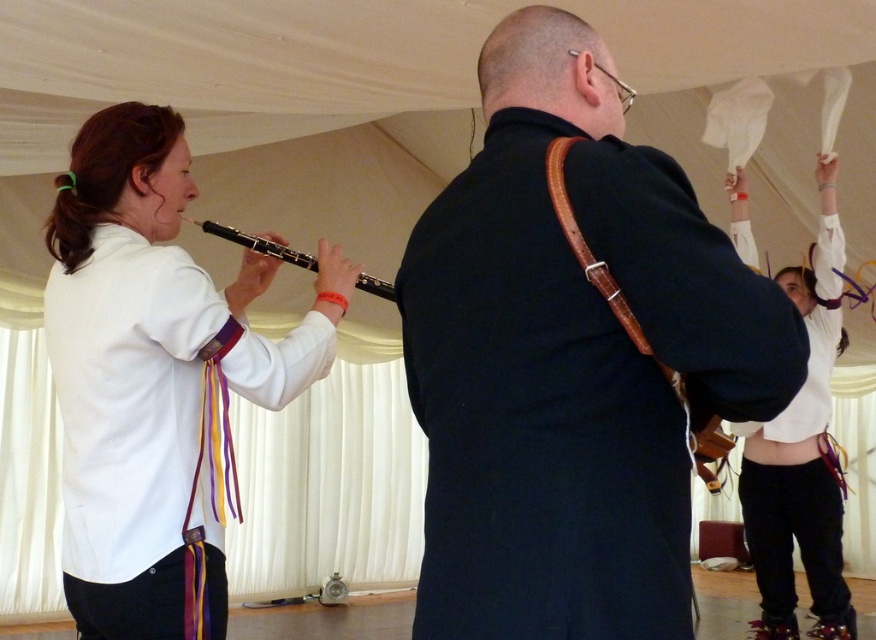
Question: Is dark blue jacket at center bigger than white matte pants at lower right?

Choices:
 (A) no
 (B) yes

Answer: (A)

Question: Among these points, which one is farthest from the camera?

Choices:
 (A) (576, 196)
 (B) (152, 493)
 (C) (361, 276)

Answer: (C)

Question: Based on their relative distances, which object is farther from the white matte flute at left?

Choices:
 (A) black wood flute at left
 (B) white matte pants at lower right

Answer: (B)

Question: Does white matte pants at lower right appear under black wood flute at left?

Choices:
 (A) no
 (B) yes

Answer: (B)

Question: Can you confirm if white matte flute at left is bigger than white matte pants at lower right?

Choices:
 (A) no
 (B) yes

Answer: (A)

Question: Which of the following is the farthest from the observer?

Choices:
 (A) white matte flute at left
 (B) white matte pants at lower right
 (C) dark blue jacket at center
 (D) black wood flute at left

Answer: (B)